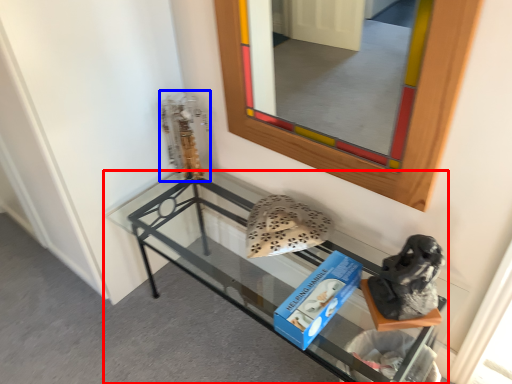
Question: Which of the following is the closest to the observer, shelf (highlighted by a red box) or sculpture (highlighted by a blue box)?

Choices:
 (A) shelf
 (B) sculpture

Answer: (A)